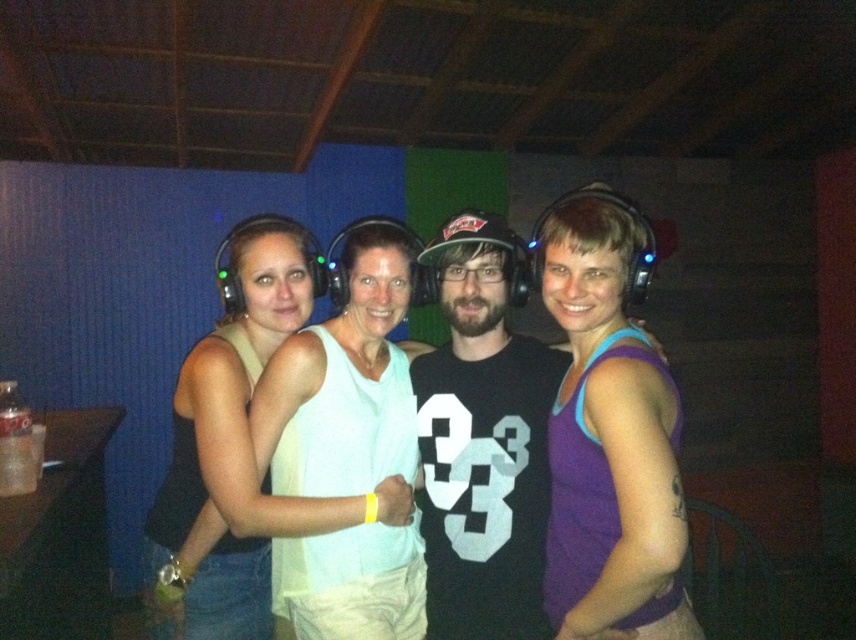
Question: Does purple matte tank top at center have a lesser width compared to black matte t-shirt at center?

Choices:
 (A) yes
 (B) no

Answer: (A)

Question: Can you confirm if black matte t-shirt at center is bigger than matte white tank top at center?

Choices:
 (A) yes
 (B) no

Answer: (B)

Question: Which object appears closest to the camera in this image?

Choices:
 (A) matte white tank top at center
 (B) purple matte tank top at center

Answer: (B)

Question: Among these points, which one is nearest to the camera?

Choices:
 (A) (182, 387)
 (B) (604, 429)

Answer: (B)

Question: Is purple matte tank top at center positioned in front of matte white tank top at center?

Choices:
 (A) yes
 (B) no

Answer: (A)

Question: Estimate the real-world distances between objects in this image. Which object is farther from the purple matte tank top at center?

Choices:
 (A) black matte t-shirt at center
 (B) matte white tank top at center

Answer: (B)